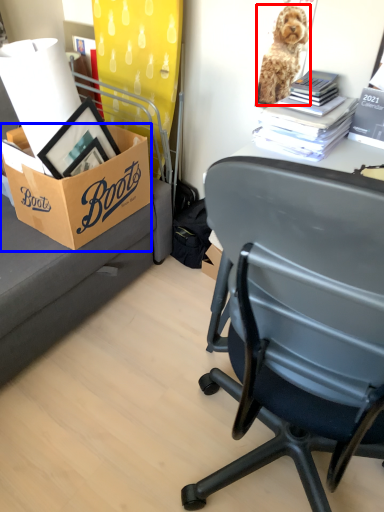
Question: Which object appears farthest to the camera in this image, dog (highlighted by a red box) or box (highlighted by a blue box)?

Choices:
 (A) dog
 (B) box

Answer: (A)